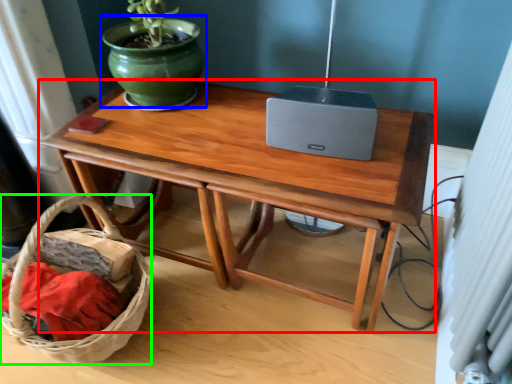
Question: Which is farther away from table (highlighted by a red box)? flowerpot (highlighted by a blue box) or basket (highlighted by a green box)?

Choices:
 (A) flowerpot
 (B) basket

Answer: (B)